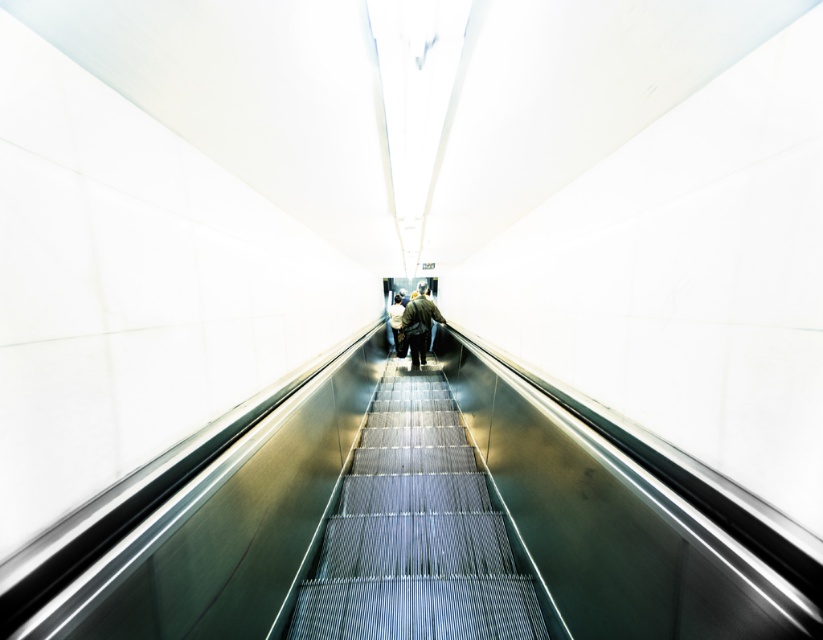
Question: Which object is closer to the camera taking this photo?

Choices:
 (A) green textured jacket at center
 (B) metallic silver stairs at center

Answer: (B)

Question: Among these objects, which one is farthest from the camera?

Choices:
 (A) metallic silver stairs at center
 (B) green textured jacket at center

Answer: (B)

Question: Does metallic silver stairs at center appear on the right side of green textured jacket at center?

Choices:
 (A) yes
 (B) no

Answer: (A)

Question: Can you confirm if metallic silver stairs at center is positioned below green textured jacket at center?

Choices:
 (A) no
 (B) yes

Answer: (B)

Question: Which point is farther to the camera?

Choices:
 (A) (379, 513)
 (B) (408, 316)

Answer: (B)

Question: Can you confirm if metallic silver stairs at center is thinner than green textured jacket at center?

Choices:
 (A) no
 (B) yes

Answer: (A)